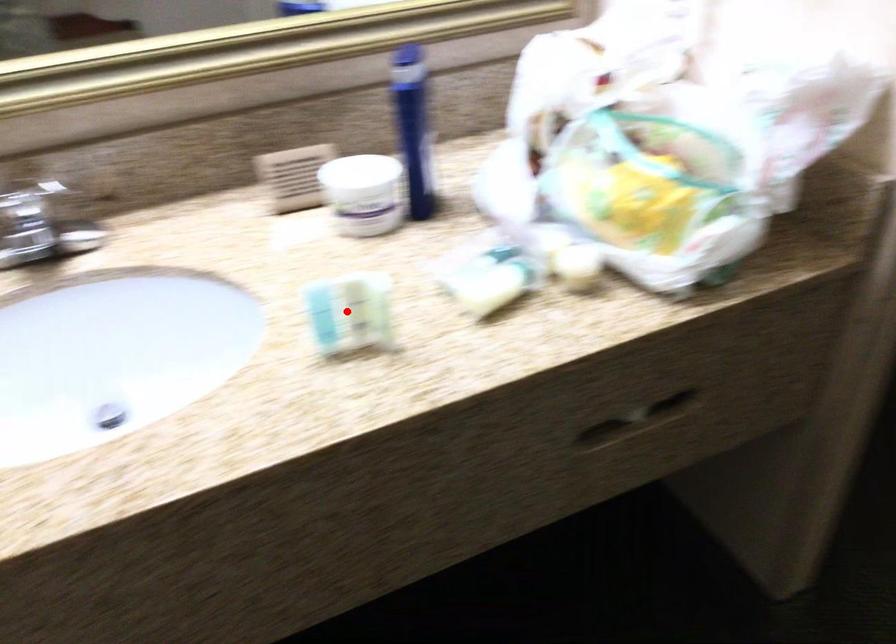
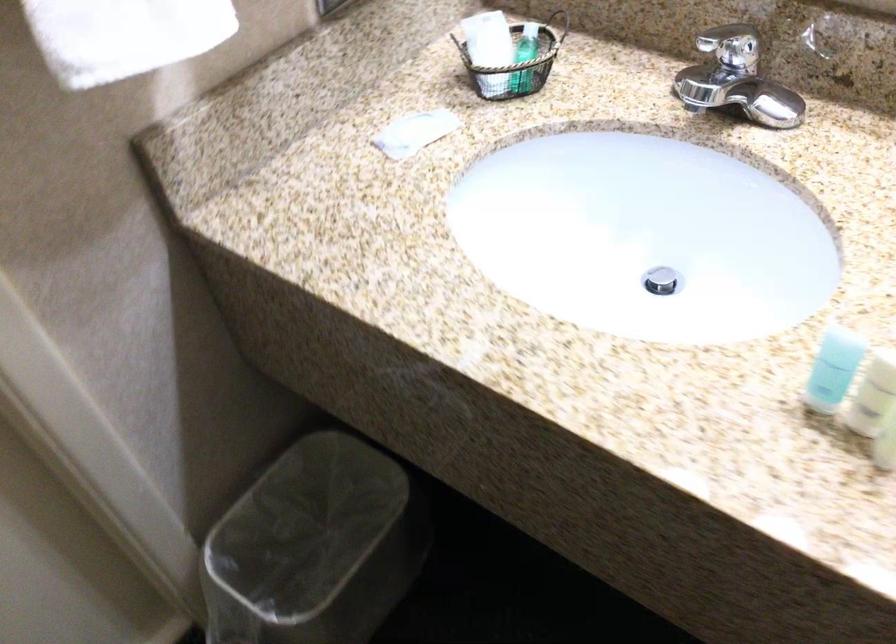
The point at the highlighted location is marked in the first image. Where is the corresponding point in the second image?

(873, 395)